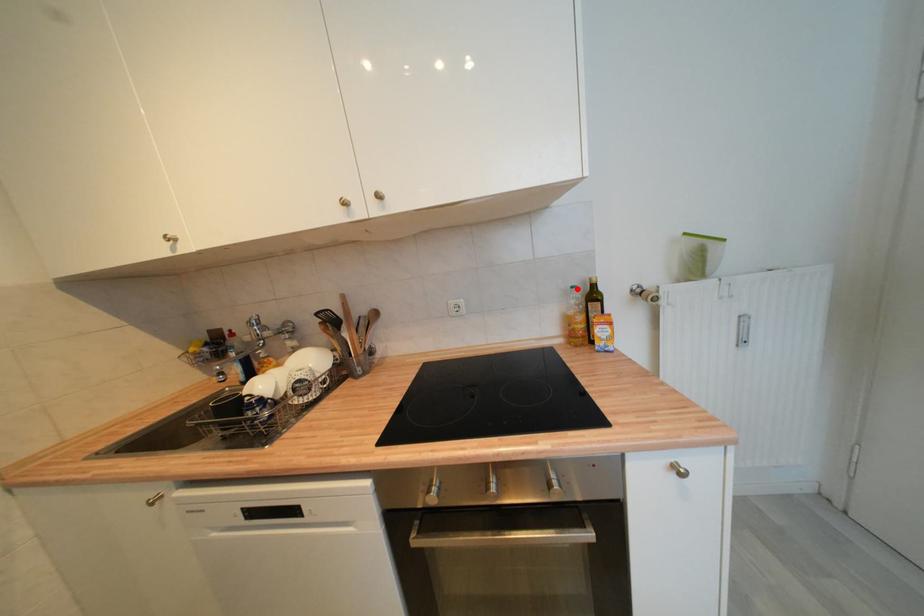
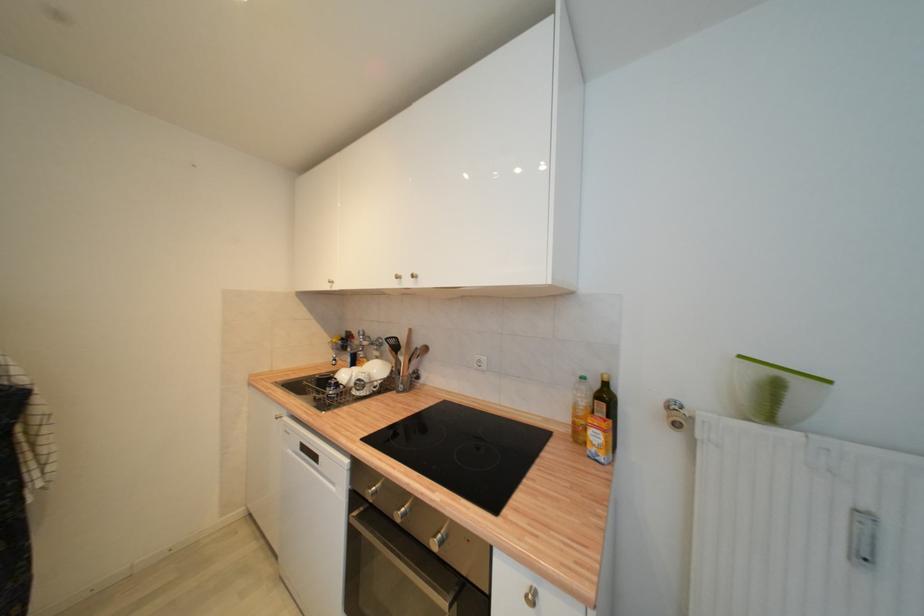
The point at the highlighted location is marked in the first image. Where is the corresponding point in the second image?

(586, 379)